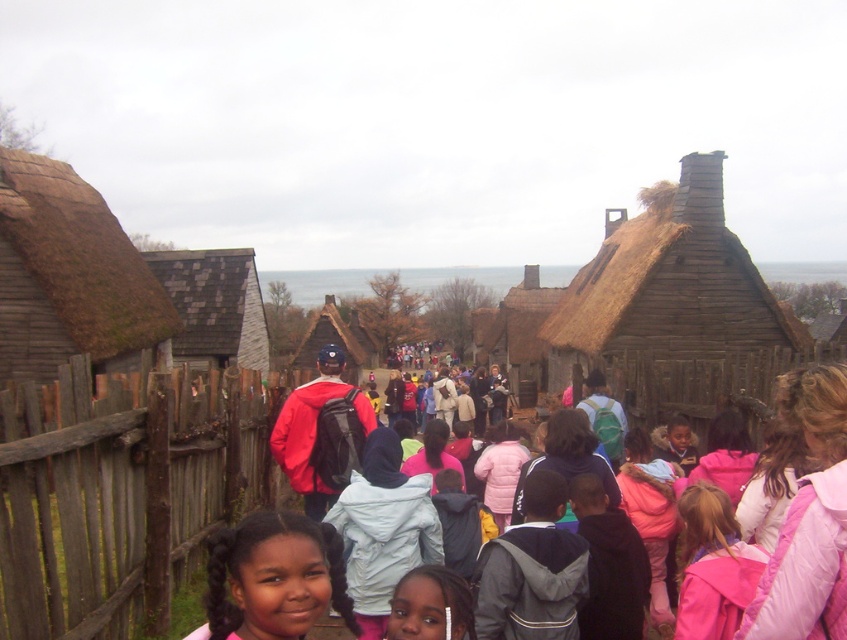
Question: Which object is positioned farthest from the gray shingled hut at center?

Choices:
 (A) matte pink jacket at lower center
 (B) brown thatched roof hut at center
 (C) thatched wood hut at left
 (D) dark brown hair at center

Answer: (B)

Question: Which point appears farthest from the camera in this image?

Choices:
 (A) (639, 477)
 (B) (209, 280)
 (C) (114, 560)

Answer: (B)

Question: Can you confirm if dark brown hair at center is wider than matte pink jacket at lower center?

Choices:
 (A) no
 (B) yes

Answer: (B)

Question: From the image, what is the correct spatial relationship of dark brown hair at center in relation to gray shingled hut at center?

Choices:
 (A) below
 (B) above

Answer: (A)

Question: Is thatched wood hut at center above thatched wood hut at left?

Choices:
 (A) no
 (B) yes

Answer: (A)

Question: Which object appears closest to the camera in this image?

Choices:
 (A) thatched wood hut at left
 (B) matte pink jacket at lower center

Answer: (B)